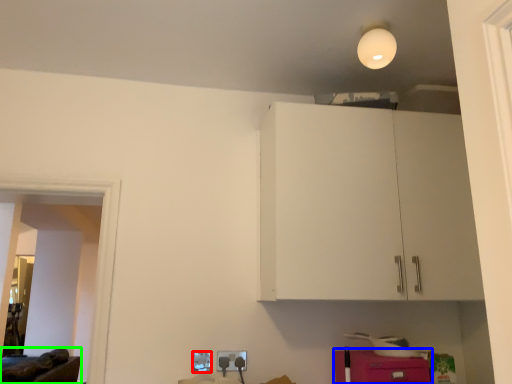
Question: Based on their relative distances, which object is farther from electric outlet (highlighted by a red box)? Choose from cabinetry (highlighted by a blue box) and furniture (highlighted by a green box).

Choices:
 (A) cabinetry
 (B) furniture

Answer: (B)